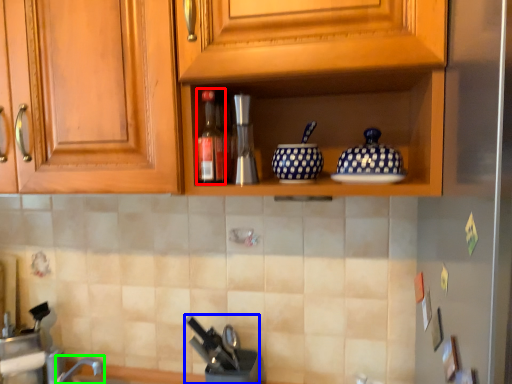
Question: Which is farther away from bottle (highlighted by a red box)? appliance (highlighted by a blue box) or faucet (highlighted by a green box)?

Choices:
 (A) appliance
 (B) faucet

Answer: (B)